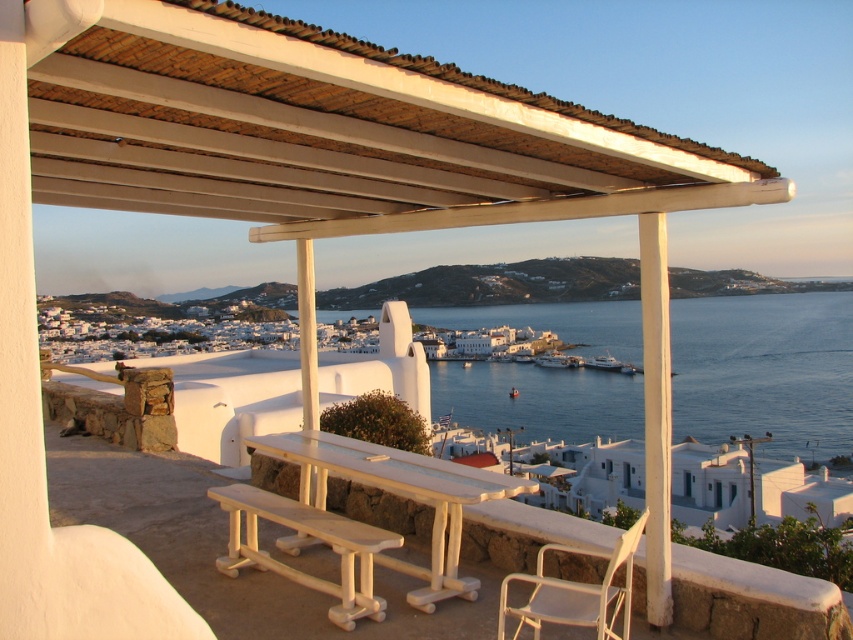
Consider the image. Who is more forward, (345, 625) or (589, 596)?

Point (589, 596)

In the scene shown: Is white wood bench at lower center closer to the viewer compared to white plastic chair at lower right?

That is False.

Which is behind, point (239, 500) or point (525, 616)?

Positioned behind is point (239, 500).

I want to click on white wood bench at lower center, so click(x=312, y=538).

Can you confirm if white wood table at center is positioned to the left of white wood bench at lower center?

Incorrect, white wood table at center is not on the left side of white wood bench at lower center.

Who is positioned more to the right, white wood table at center or white wood bench at lower center?

Positioned to the right is white wood table at center.

Where is `white wood table at center`? The image size is (853, 640). white wood table at center is located at coordinates (398, 496).

Does point (219, 88) lie behind point (323, 536)?

No, it is in front of (323, 536).

Is point (236, 154) less distant than point (369, 608)?

That is True.

Measure the distance between point (x=640, y=132) and camera.

The distance of point (x=640, y=132) from camera is 3.82 meters.

Where is `white wood at upper center`? The image size is (853, 640). white wood at upper center is located at coordinates (337, 132).